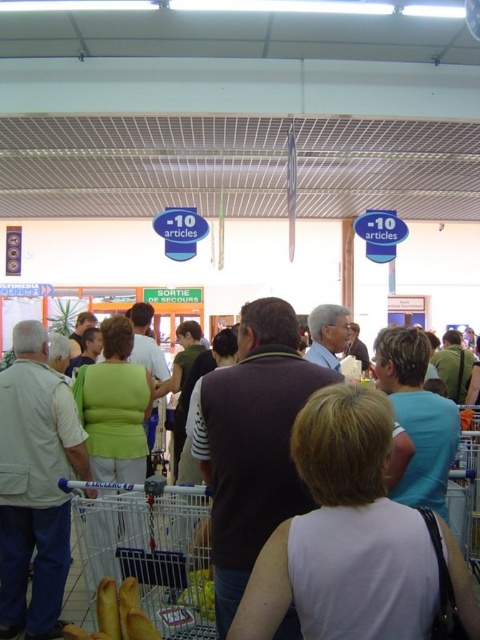
From the picture: You are standing in the checkout area of a supermarket and see a point at coordinates (36, 484). According to the image, which object is this point located on?

The point at coordinates (36, 484) is located on the light beige cotton shirt at center.

You are a store employee organizing a clothing rack and need to place the light beige cotton shirt at center and the light blue fabric shirt at center side by side. Given their sizes, which shirt should be placed on the left to ensure they both fit on the rack without overlapping?

The light beige cotton shirt at center has a larger width than the light blue fabric shirt at center. To fit them side by side without overlapping, the larger light beige cotton shirt at center should be placed on the left, and the smaller light blue fabric shirt at center on the right.